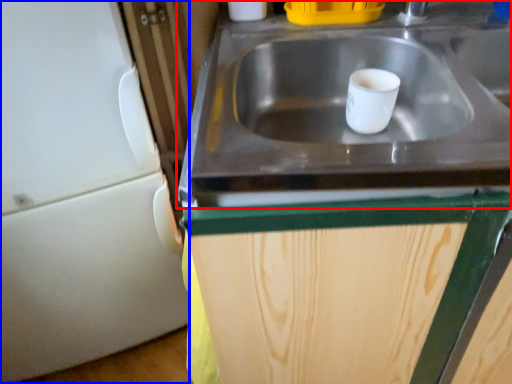
Question: Which point is further to the camera, sink (highlighted by a red box) or appliance (highlighted by a blue box)?

Choices:
 (A) sink
 (B) appliance

Answer: (B)